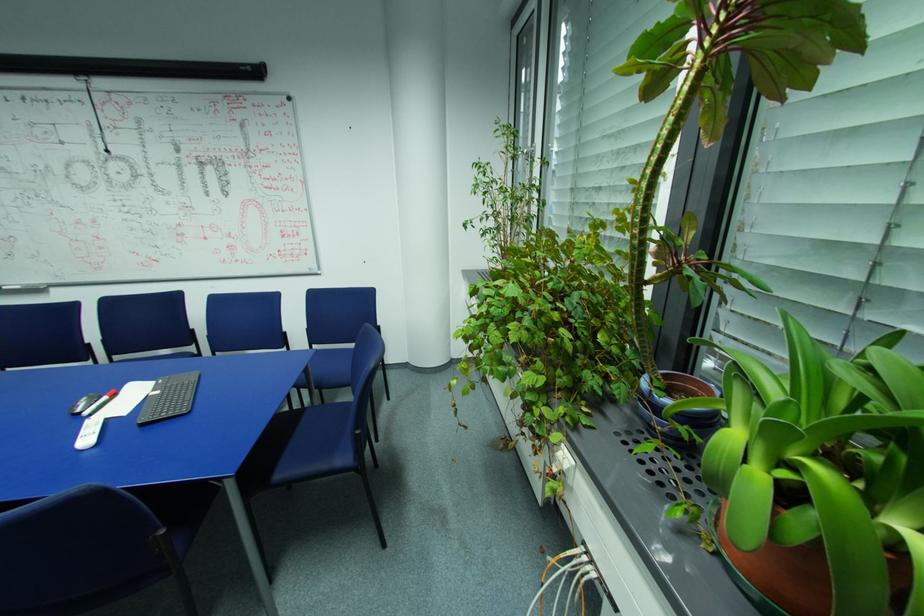
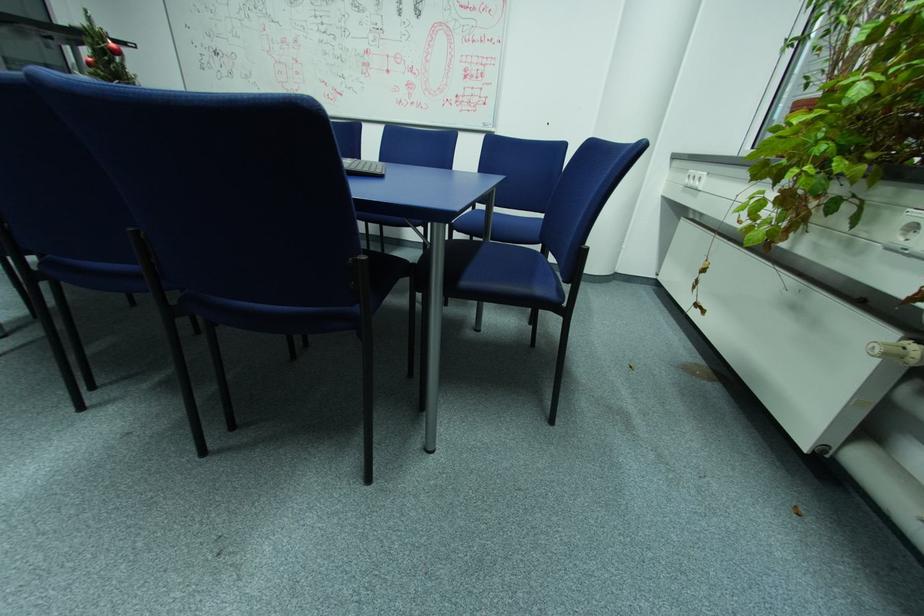
Which direction would the cameraman need to move to produce the second image?

The cameraman moved toward left, forward.